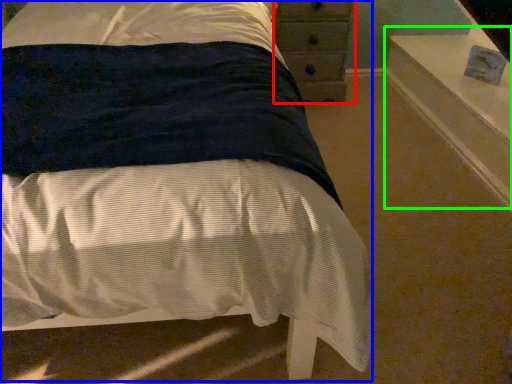
Question: Estimate the real-world distances between objects in this image. Which object is closer to chest of drawers (highlighted by a red box), bed (highlighted by a blue box) or window sill (highlighted by a green box)?

Choices:
 (A) bed
 (B) window sill

Answer: (B)